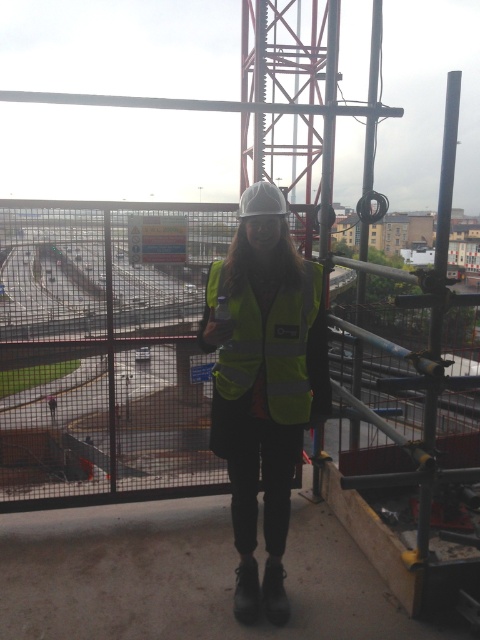
Does metal mesh fence at center have a greater height compared to high-visibility fabric safety vest at center?

Yes, metal mesh fence at center is taller than high-visibility fabric safety vest at center.

The image size is (480, 640). Describe the element at coordinates (204, 362) in the screenshot. I see `metal mesh fence at center` at that location.

Locate an element on the screen. Image resolution: width=480 pixels, height=640 pixels. metal mesh fence at center is located at coordinates (204, 362).

Is metal mesh fence at center shorter than yellow reflective vest at center?

Incorrect, metal mesh fence at center's height does not fall short of yellow reflective vest at center's.

Is metal mesh fence at center thinner than yellow reflective vest at center?

In fact, metal mesh fence at center might be wider than yellow reflective vest at center.

Does point (355, 438) come behind point (255, 224)?

Yes, it is.

Find the location of `metal mesh fence at center`. metal mesh fence at center is located at coordinates (204, 362).

From the picture: Who is taller, yellow reflective vest at center or high-visibility fabric safety vest at center?

yellow reflective vest at center is taller.

Can you confirm if yellow reflective vest at center is positioned above high-visibility fabric safety vest at center?

No.

Is point (271, 614) positioned in front of point (282, 291)?

No.

Where is `yellow reflective vest at center`? The height and width of the screenshot is (640, 480). yellow reflective vest at center is located at coordinates (264, 381).